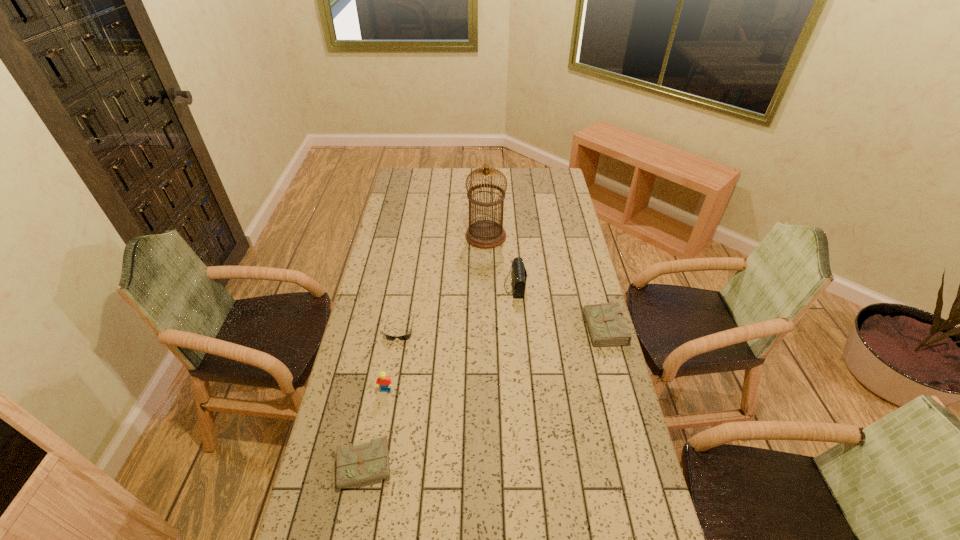
Locate an element on the screen. This screenshot has height=540, width=960. free region located 0.080m on the left of the third shortest object is located at coordinates (565, 334).

Where is `vacant space situated on the front flap of the clutch bag`? vacant space situated on the front flap of the clutch bag is located at coordinates (468, 286).

The height and width of the screenshot is (540, 960). Find the location of `vacant space situated on the front flap of the clutch bag`. vacant space situated on the front flap of the clutch bag is located at coordinates (490, 286).

Identify the location of free space located 0.400m on the front flap of the clutch bag. Image resolution: width=960 pixels, height=540 pixels. (407, 286).

Where is `vacant position located 0.200m on the front-facing side of the tallest object`? vacant position located 0.200m on the front-facing side of the tallest object is located at coordinates (422, 236).

Find the location of a particular element. vacant space situated 0.070m on the front-facing side of the tallest object is located at coordinates (450, 236).

Where is `blank space located 0.080m on the front-facing side of the tallest object`? The width and height of the screenshot is (960, 540). blank space located 0.080m on the front-facing side of the tallest object is located at coordinates (448, 236).

You are a GUI agent. You are given a task and a screenshot of the screen. Output one action in this format:
    pyautogui.click(x=<x>, y=<y>)
    Task: Click on the free space located 0.320m on the front-facing side of the shortest object
    This screenshot has width=960, height=540.
    Given the screenshot: What is the action you would take?
    pyautogui.click(x=383, y=422)

Image resolution: width=960 pixels, height=540 pixels. I want to click on vacant space located on the face of the Lego, so click(372, 471).

Locate an element on the screen. The image size is (960, 540). diary that is at the left edge is located at coordinates (359, 464).